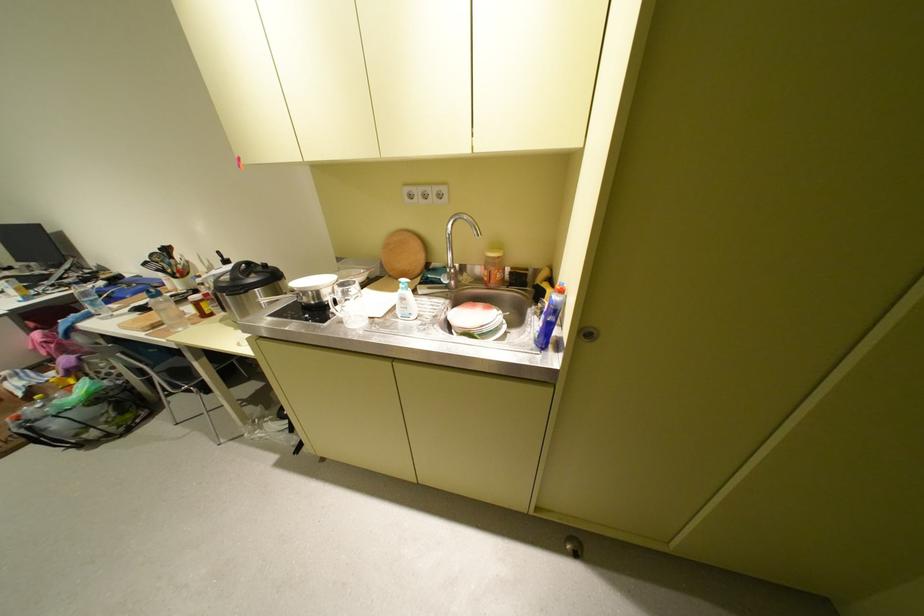
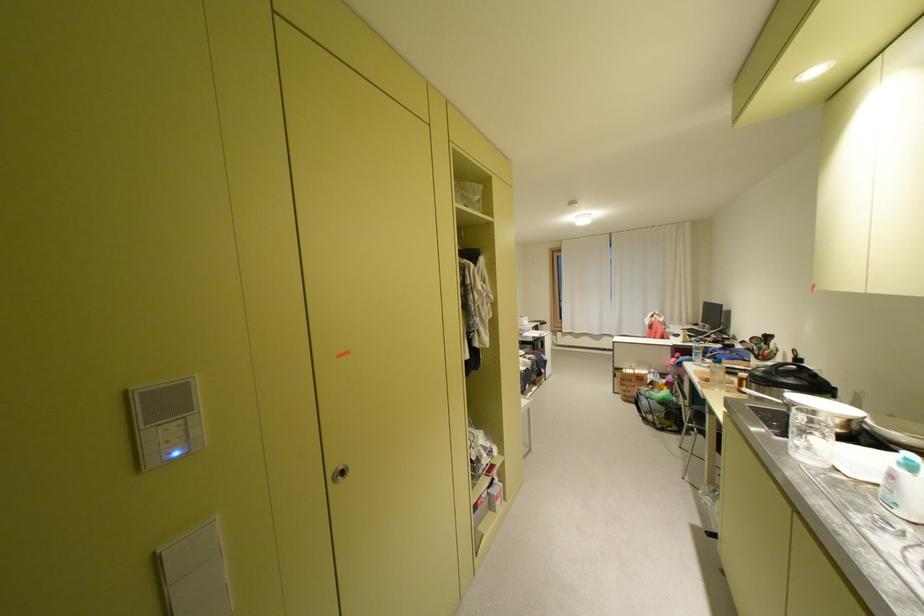
Find the pixel in the second image that matches pixel 421 314 in the first image.

(906, 505)